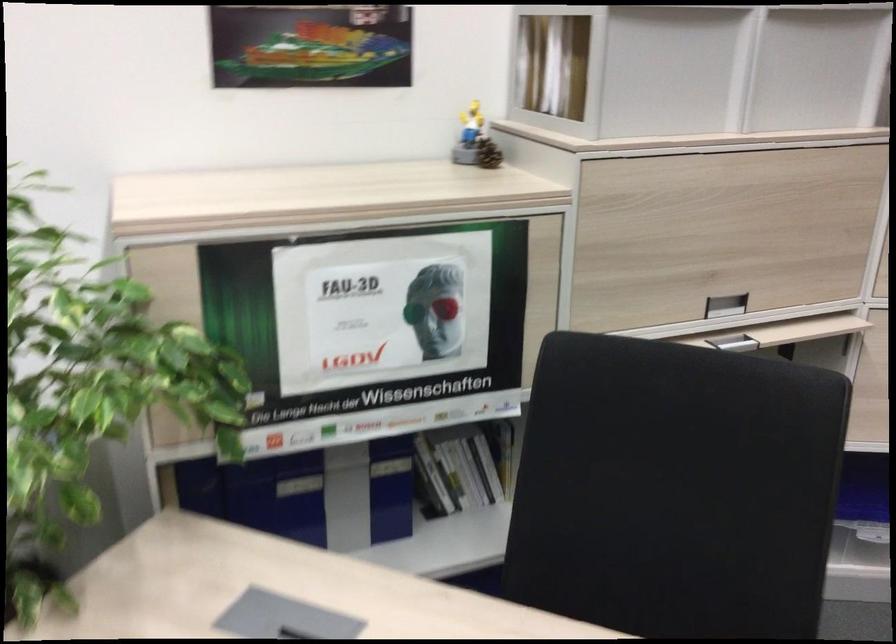
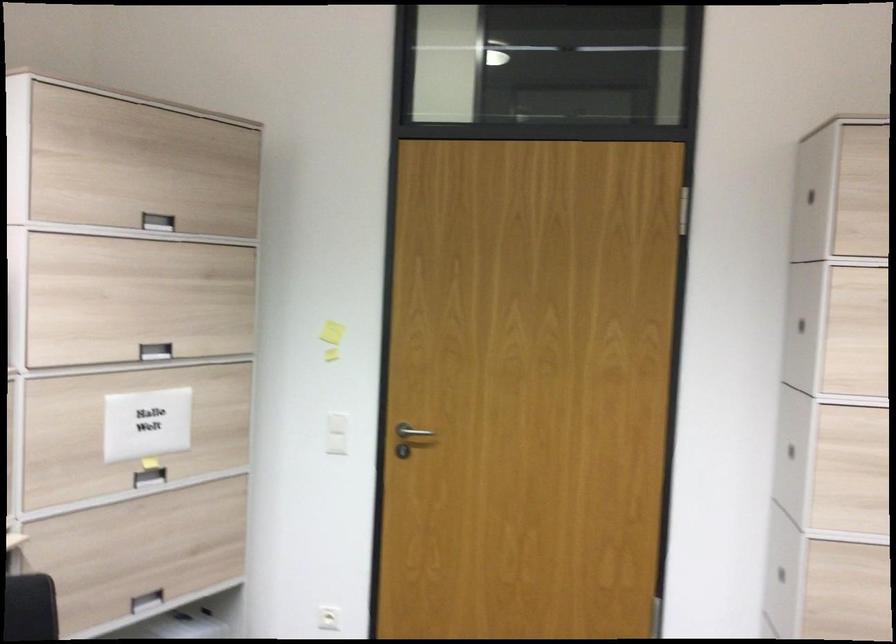
Question: The images are taken continuously from a first-person perspective. In which direction is your viewpoint rotating?

Choices:
 (A) Left
 (B) Right
 (C) Up
 (D) Down

Answer: (B)